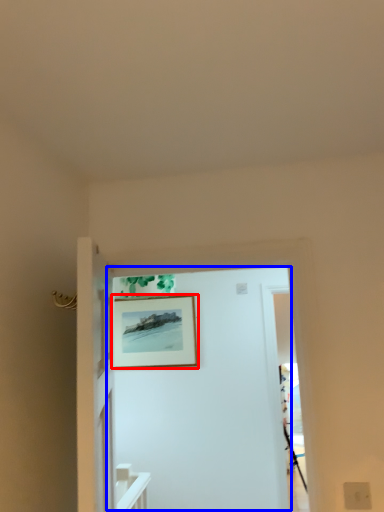
Question: Which object is further to the camera taking this photo, picture frame (highlighted by a red box) or door (highlighted by a blue box)?

Choices:
 (A) picture frame
 (B) door

Answer: (A)